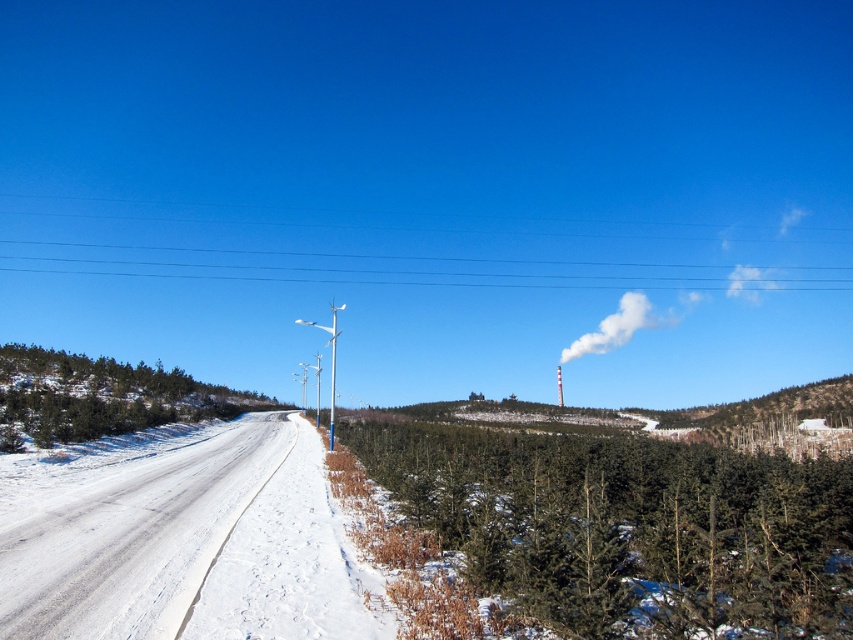
Question: Which of the following is the closest to the observer?

Choices:
 (A) white plastic streetlight at center
 (B) green matte tree at left
 (C) clear blue wires at upper center

Answer: (B)

Question: Which is nearer to the smooth gray pipe at upper center?

Choices:
 (A) white smoke at upper center
 (B) green matte tree at left

Answer: (A)

Question: Is green matte tree at lower right thinner than clear blue wires at upper center?

Choices:
 (A) yes
 (B) no

Answer: (A)

Question: Estimate the real-world distances between objects in this image. Which object is closer to the clear blue wires at upper center?

Choices:
 (A) smooth gray pipe at upper center
 (B) white smoke at upper center
 (C) white plastic streetlight at center

Answer: (B)

Question: Is clear blue wires at upper center bigger than white smoke at upper center?

Choices:
 (A) yes
 (B) no

Answer: (A)

Question: Does white smoke at upper center appear over smooth gray pipe at upper center?

Choices:
 (A) yes
 (B) no

Answer: (A)